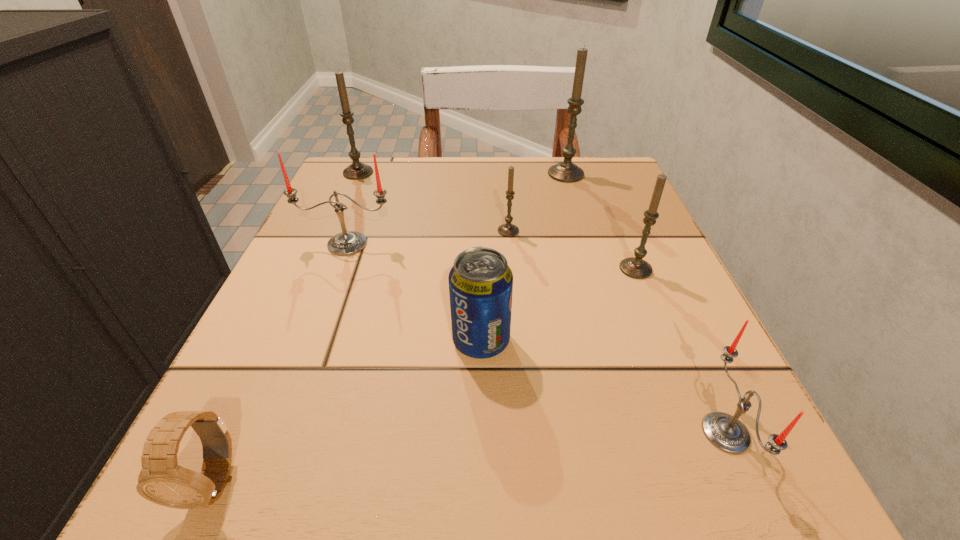
Locate an element on the screen. vacant space at the far edge of the desktop is located at coordinates (420, 157).

In the image, there is a desktop. What are the coordinates of `free region at the near edge` in the screenshot? It's located at (612, 517).

Identify the location of vacant space at the left edge of the desktop. (242, 432).

Find the location of a particular element. free region at the right edge is located at coordinates (611, 297).

The height and width of the screenshot is (540, 960). Find the location of `vacant space at the far left corner`. vacant space at the far left corner is located at coordinates (356, 181).

Locate an element on the screen. free space at the far right corner is located at coordinates (591, 175).

This screenshot has height=540, width=960. In order to click on vacant point located between the tallest candle and the second smallest gray candle in this screenshot , I will do `click(601, 221)`.

Find the location of a particular element. unoccupied position between the shortest object and the rightmost gray candle is located at coordinates (425, 375).

Locate an element on the screen. The width and height of the screenshot is (960, 540). free spot between the second biggest gray candle and the left red candle is located at coordinates (352, 208).

Identify the location of free area in between the nearer red candle and the third farthest gray candle. (617, 332).